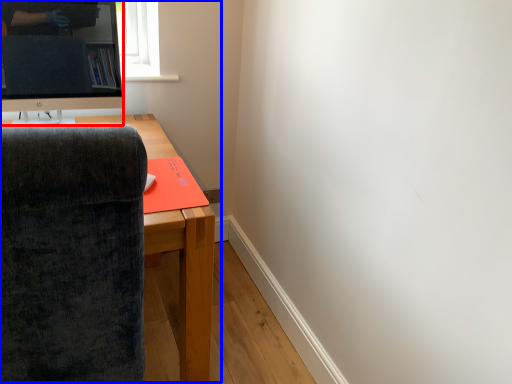
Question: Among these objects, which one is nearest to the camera, television (highlighted by a red box) or entertainment center (highlighted by a blue box)?

Choices:
 (A) television
 (B) entertainment center

Answer: (B)